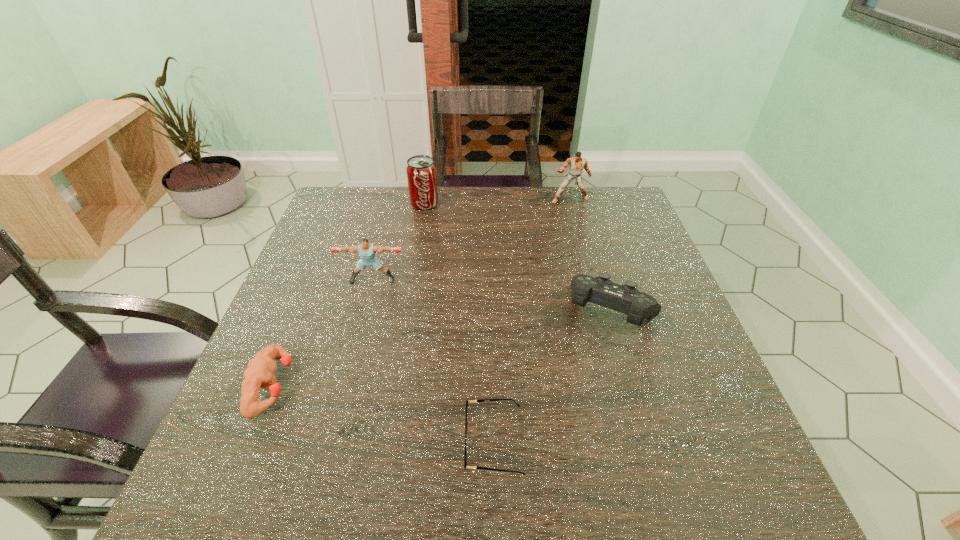
At what (x,y) coordinates should I click in order to perform the action: click on free space at the far right corner of the desktop. Please return your answer as a coordinate pair (x, y). Image resolution: width=960 pixels, height=540 pixels. Looking at the image, I should click on (606, 198).

Find the location of a particular element. The image size is (960, 540). free region at the near right corner of the desktop is located at coordinates (776, 511).

Find the location of a particular element. The height and width of the screenshot is (540, 960). free spot between the control and the second shortest puncher is located at coordinates (492, 296).

Where is `free space between the fifth tallest object and the control`? free space between the fifth tallest object and the control is located at coordinates (443, 349).

This screenshot has height=540, width=960. Identify the location of blank region between the fourth tallest object and the leftmost object. (443, 349).

Locate an element on the screen. This screenshot has height=540, width=960. empty location between the second puncher from left to right and the rightmost puncher is located at coordinates (471, 240).

Where is `empty space that is in between the pop soda and the tallest puncher`? empty space that is in between the pop soda and the tallest puncher is located at coordinates (497, 202).

The width and height of the screenshot is (960, 540). Identify the location of vacant space in between the pop soda and the control. (518, 258).

In order to click on vacant area that lies between the third shortest object and the third object from right to left in this screenshot , I will do `click(553, 377)`.

You are a GUI agent. You are given a task and a screenshot of the screen. Output one action in this format:
    pyautogui.click(x=<x>, y=<y>)
    Task: Click on the unoccupied position between the pop soda and the second shortest object
    The image size is (960, 540).
    Given the screenshot: What is the action you would take?
    pyautogui.click(x=348, y=294)